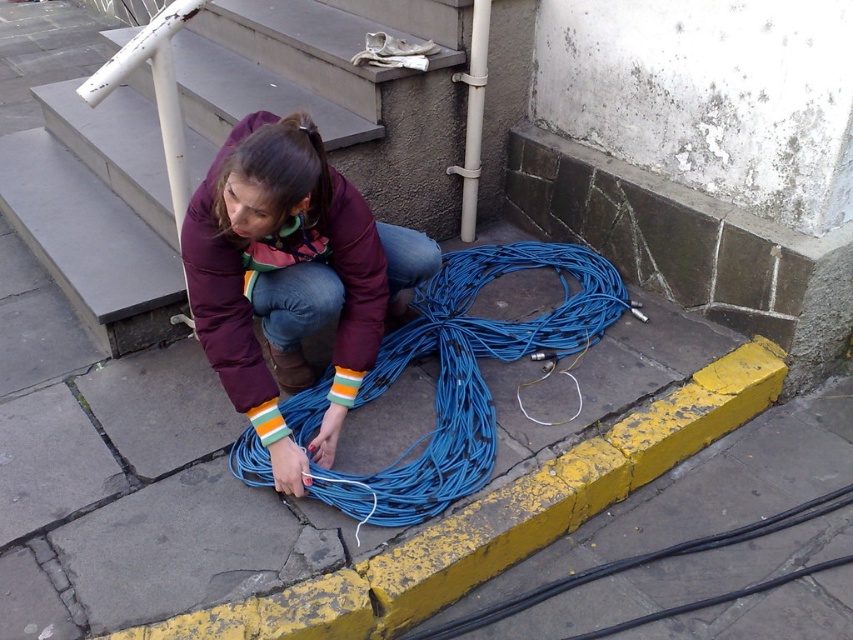
Who is taller, yellow painted curb at lower center or blue rubber wire at lower center?

With more height is blue rubber wire at lower center.

Is point (229, 634) positioned after point (506, 358)?

No, (229, 634) is in front of (506, 358).

You are a GUI agent. You are given a task and a screenshot of the screen. Output one action in this format:
    pyautogui.click(x=<x>, y=<y>)
    Task: Click on the yellow painted curb at lower center
    Image resolution: width=853 pixels, height=640 pixels.
    Given the screenshot: What is the action you would take?
    pyautogui.click(x=498, y=518)

Can you confirm if concrete stairs at center is thinner than yellow painted curb at lower center?

No, concrete stairs at center is not thinner than yellow painted curb at lower center.

Is point (10, 216) positioned before point (747, 404)?

No, (10, 216) is further to viewer.

The height and width of the screenshot is (640, 853). I want to click on concrete stairs at center, so click(97, 209).

Measure the distance from matte purple jacket at center to blue rubber wire at lower center.

The distance of matte purple jacket at center from blue rubber wire at lower center is 36.16 centimeters.

Can you confirm if matte purple jacket at center is positioned to the left of blue rubber wire at lower center?

Indeed, matte purple jacket at center is positioned on the left side of blue rubber wire at lower center.

Who is more forward, [231,250] or [390,484]?

Point [231,250] is in front.

I want to click on matte purple jacket at center, so click(x=289, y=276).